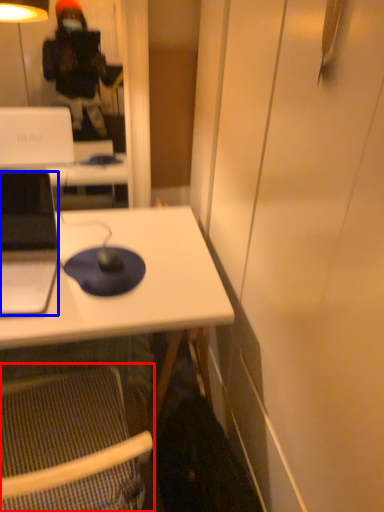
Question: Which of the following is the closest to the observer, folding chair (highlighted by a red box) or laptop (highlighted by a blue box)?

Choices:
 (A) folding chair
 (B) laptop

Answer: (A)